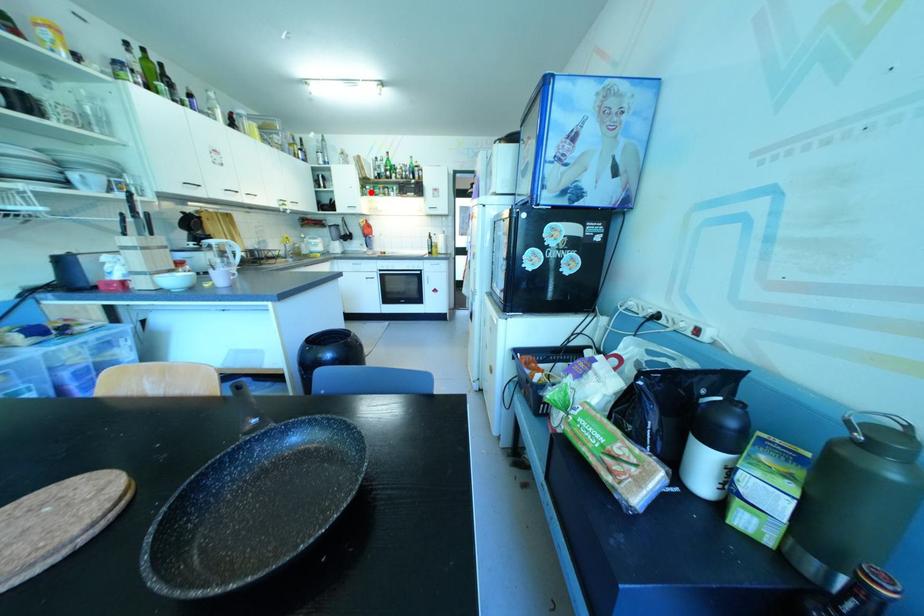
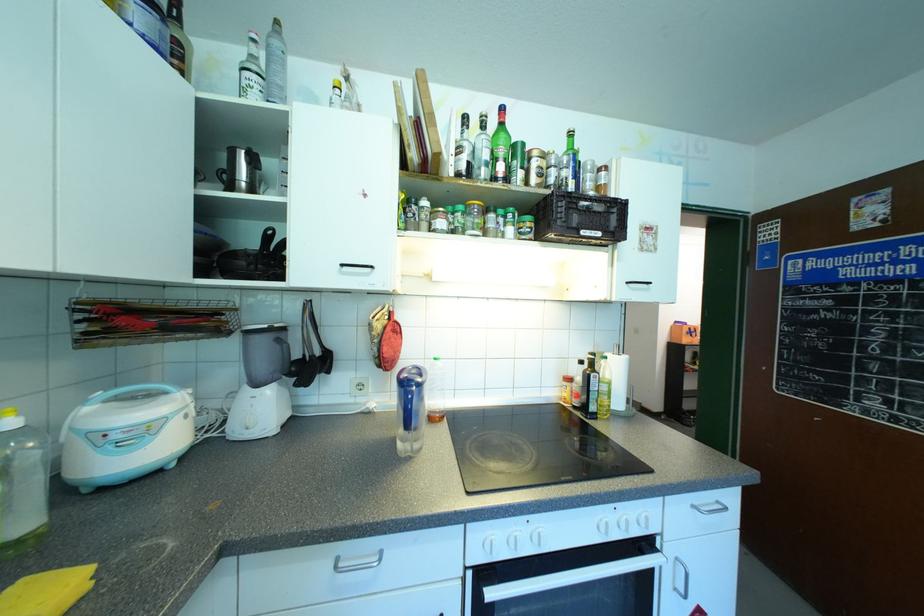
Where in the second image is the point corresponding to the highlighted location from the first image?

(440, 223)